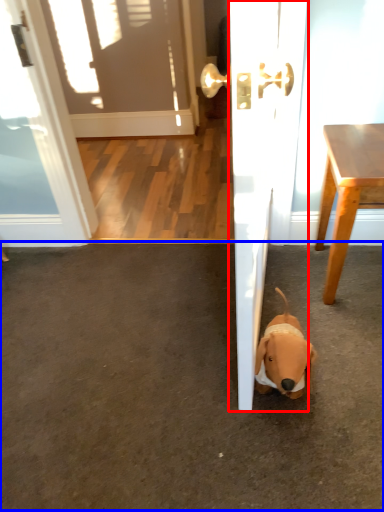
Question: Which object appears closest to the camera in this image, door (highlighted by a red box) or concrete (highlighted by a blue box)?

Choices:
 (A) door
 (B) concrete

Answer: (A)